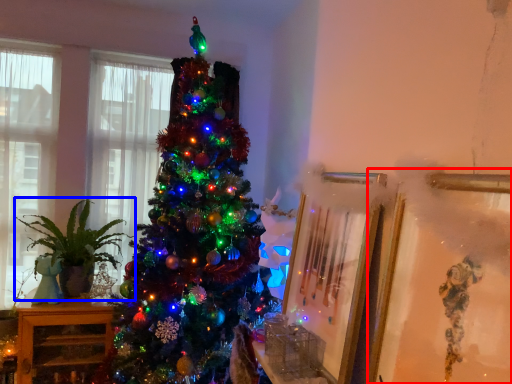
Question: Which of the following is the closest to the observer, picture frame (highlighted by a red box) or houseplant (highlighted by a blue box)?

Choices:
 (A) picture frame
 (B) houseplant

Answer: (A)